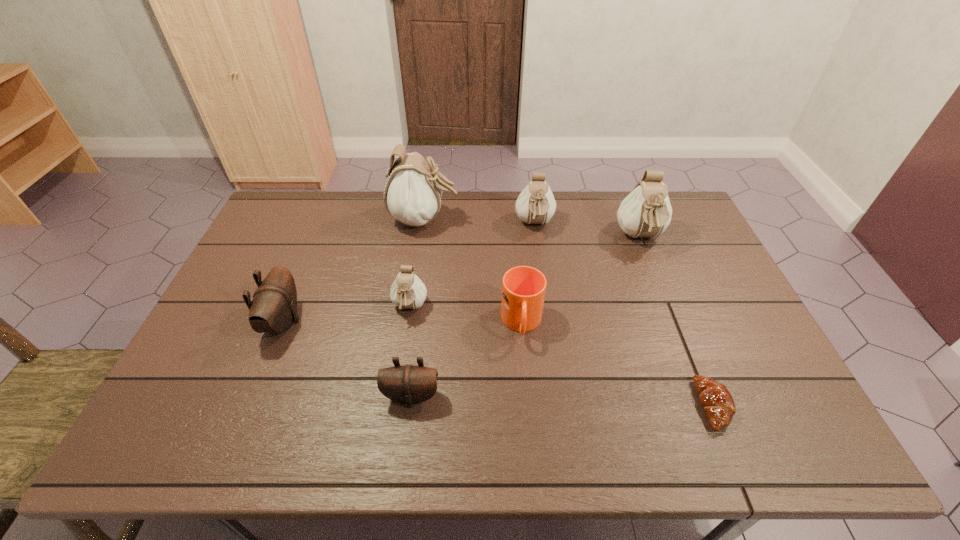
Find the location of a particular element. The width and height of the screenshot is (960, 540). vacant area at the right edge is located at coordinates (708, 257).

At what (x,y) coordinates should I click in order to perform the action: click on free space at the far left corner of the desktop. Please return your answer as a coordinate pair (x, y). Looking at the image, I should click on (290, 211).

At what (x,y) coordinates should I click in order to perform the action: click on free area in between the right brown pouch and the brown crescent roll. Please return your answer as a coordinate pair (x, y). The height and width of the screenshot is (540, 960). Looking at the image, I should click on (563, 401).

You are a GUI agent. You are given a task and a screenshot of the screen. Output one action in this format:
    pyautogui.click(x=<x>, y=<y>)
    Task: Click on the free spot between the orange mug and the rightmost white pouch
    The height and width of the screenshot is (540, 960).
    Given the screenshot: What is the action you would take?
    pyautogui.click(x=581, y=280)

At what (x,y) coordinates should I click in order to perform the action: click on free spot between the orange mug and the shortest object. Please return your answer as a coordinate pair (x, y). This screenshot has width=960, height=540. Looking at the image, I should click on (617, 364).

You are a GUI agent. You are given a task and a screenshot of the screen. Output one action in this format:
    pyautogui.click(x=<x>, y=<y>)
    Task: Click on the vacant region between the seventh shortest object and the bigger brown pouch
    
    Given the screenshot: What is the action you would take?
    pyautogui.click(x=462, y=280)

Locate an element on the screen. The image size is (960, 540). free space between the shortest object and the smallest white pouch is located at coordinates (562, 356).

You are a GUI agent. You are given a task and a screenshot of the screen. Output one action in this format:
    pyautogui.click(x=<x>, y=<y>)
    Task: Click on the free area in between the smaller brown pouch and the fifth pouch from left to right
    The width and height of the screenshot is (960, 540).
    Given the screenshot: What is the action you would take?
    pyautogui.click(x=473, y=310)

Identify the location of free space between the crescent roll and the rightmost pouch. (677, 321).

Where is `free space that is in between the mug and the leftmost pouch`? The image size is (960, 540). free space that is in between the mug and the leftmost pouch is located at coordinates (402, 322).